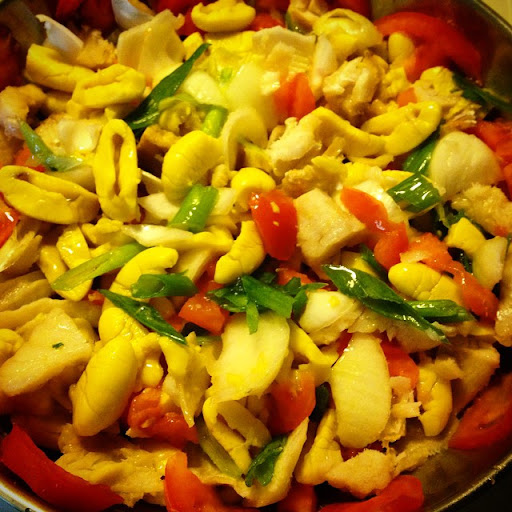
Where is `blue part of bowl`? blue part of bowl is located at coordinates (1, 508).